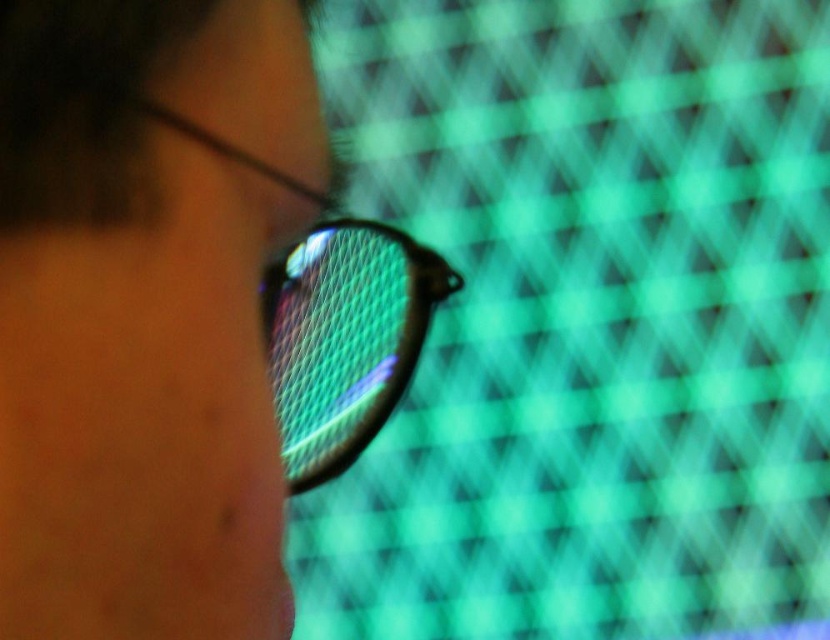
Consider the image. Who is higher up, mesh-patterned racket at center or matte black glasses at center?

matte black glasses at center is higher up.

Does mesh-patterned racket at center appear under matte black glasses at center?

Yes.

Who is more distant from viewer, (x=276, y=381) or (x=255, y=163)?

The point (x=276, y=381) is behind.

This screenshot has height=640, width=830. What are the coordinates of `mesh-patterned racket at center` in the screenshot? It's located at (344, 339).